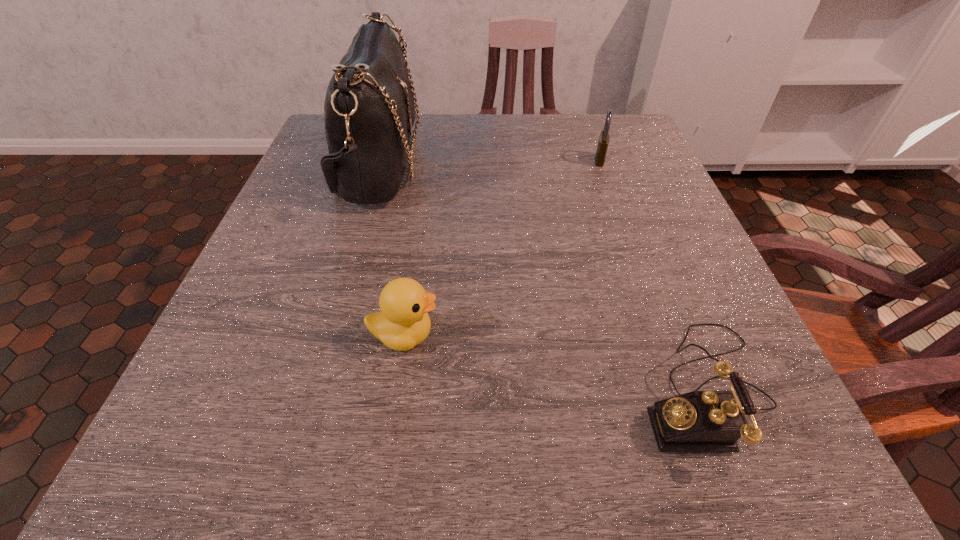
The width and height of the screenshot is (960, 540). I want to click on vacant space at the near edge of the desktop, so click(416, 465).

Find the location of a particular element. The image size is (960, 540). vacant space at the left edge of the desktop is located at coordinates (295, 423).

You are a GUI agent. You are given a task and a screenshot of the screen. Output one action in this format:
    pyautogui.click(x=<x>, y=<y>)
    Task: Click on the vacant space at the right edge of the desktop
    The width and height of the screenshot is (960, 540).
    Given the screenshot: What is the action you would take?
    tap(602, 201)

At what (x,y) coordinates should I click in order to perform the action: click on vacant space at the near left corner of the desktop. Please return your answer as a coordinate pair (x, y). This screenshot has width=960, height=540. Looking at the image, I should click on (156, 451).

You are a GUI agent. You are given a task and a screenshot of the screen. Output one action in this format:
    pyautogui.click(x=<x>, y=<y>)
    Task: Click on the vacant region between the padlock and the duck
    Image resolution: width=960 pixels, height=540 pixels.
    Given the screenshot: What is the action you would take?
    pyautogui.click(x=502, y=247)

The width and height of the screenshot is (960, 540). Find the location of `free space between the duck and the handbag`. free space between the duck and the handbag is located at coordinates (392, 249).

You are a GUI agent. You are given a task and a screenshot of the screen. Output one action in this format:
    pyautogui.click(x=<x>, y=<y>)
    Task: Click on the vacant area that lies between the padlock and the duck
    
    Given the screenshot: What is the action you would take?
    pyautogui.click(x=502, y=247)

Find the location of a particular element. Image resolution: width=960 pixels, height=540 pixels. free area in between the duck and the tallest object is located at coordinates [x=392, y=249].

Locate an element on the screen. This screenshot has height=540, width=960. vacant point located between the handbag and the duck is located at coordinates (392, 249).

The height and width of the screenshot is (540, 960). What are the coordinates of `free space that is in between the handbag and the duck` in the screenshot? It's located at (392, 249).